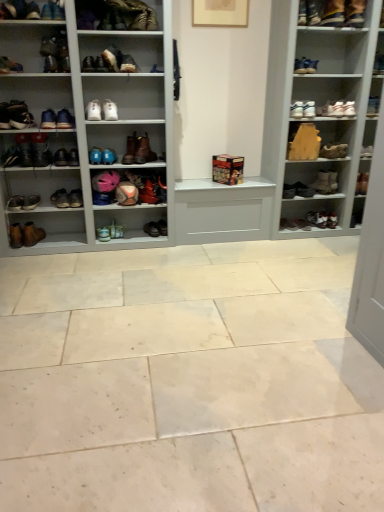
Find the location of a particular element. This screenshot has height=512, width=384. spots to the right of matte blue sneaker at center, acting as the 15th shoe starting from the right is located at coordinates (134, 237).